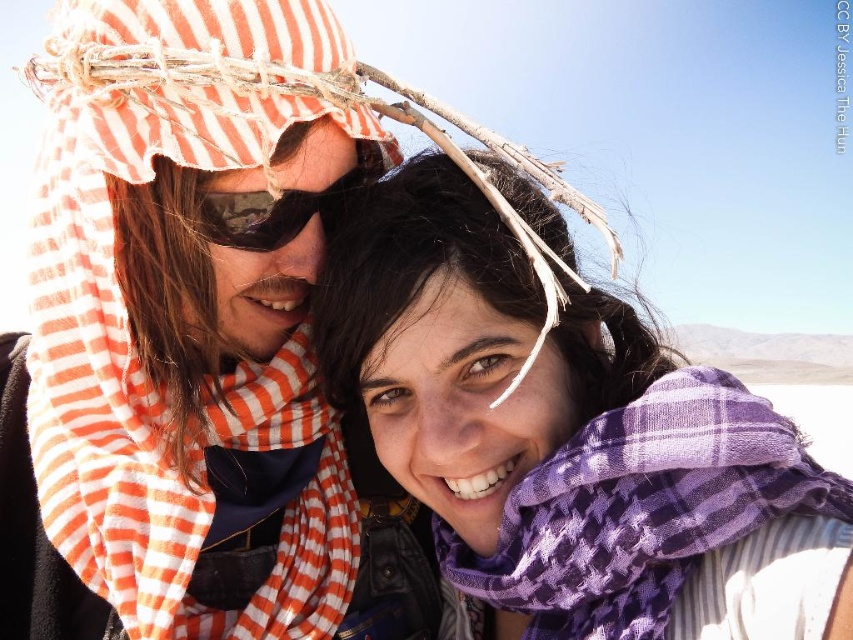
You are a photographer trying to capture both the purple plaid scarf at center and the purple checkered scarf at center in a single frame. Based on their sizes in the image, which scarf would appear larger in your photo?

The purple plaid scarf at center would appear larger in the photo since it is taller than the purple checkered scarf at center.

Looking at this image, you are taking a photo of two people in a desert landscape. You want to focus on the person closer to the camera. Which of the two points, point [657,445] or point [561,605], should you focus on to ensure the person is in focus?

Point [657,445] is closer to the camera than point [561,605], so you should focus on point [657,445] to ensure the person is in focus.

You are standing between two people in the desert. The person on the left is wearing an orange and white striped keffiyeh, and the person on the right is wearing a purple plaid scarf at center. If you want to give a high five to both without moving your position, can you reach them both?

The distance between the two people is 3.83 feet. Since the average arm span for a person is about 3 feet, you might not be able to reach both without moving.